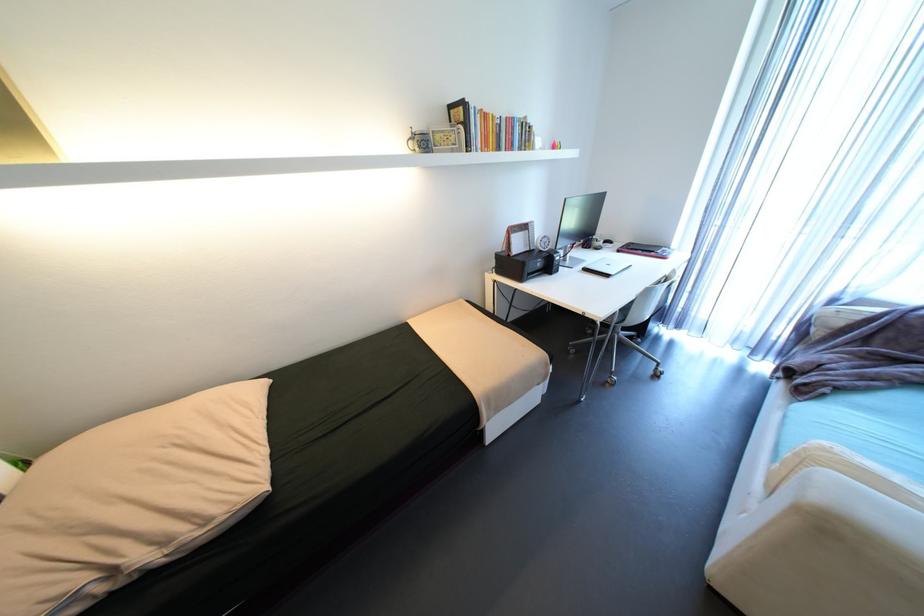
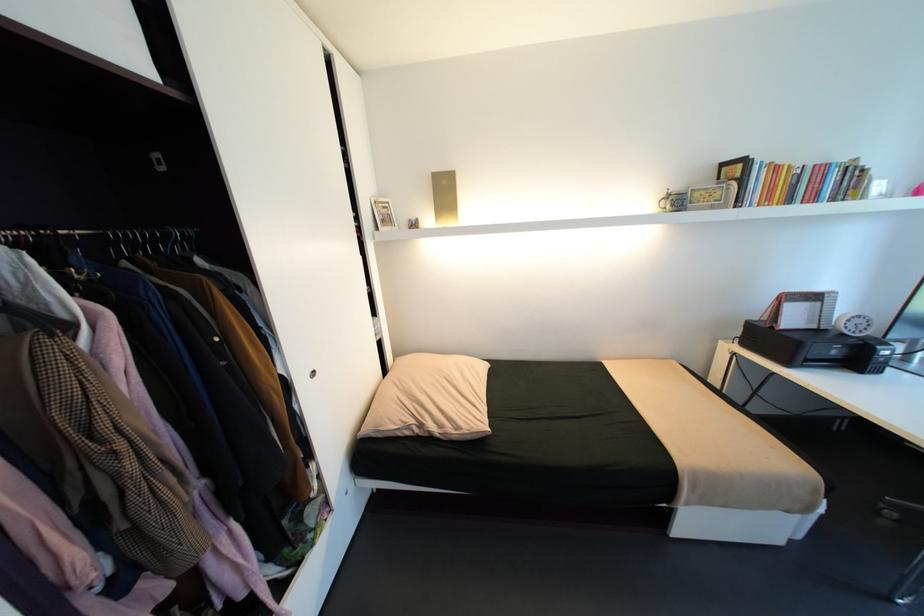
The point at (548,252) is marked in the first image. Where is the corresponding point in the second image?

(850, 334)